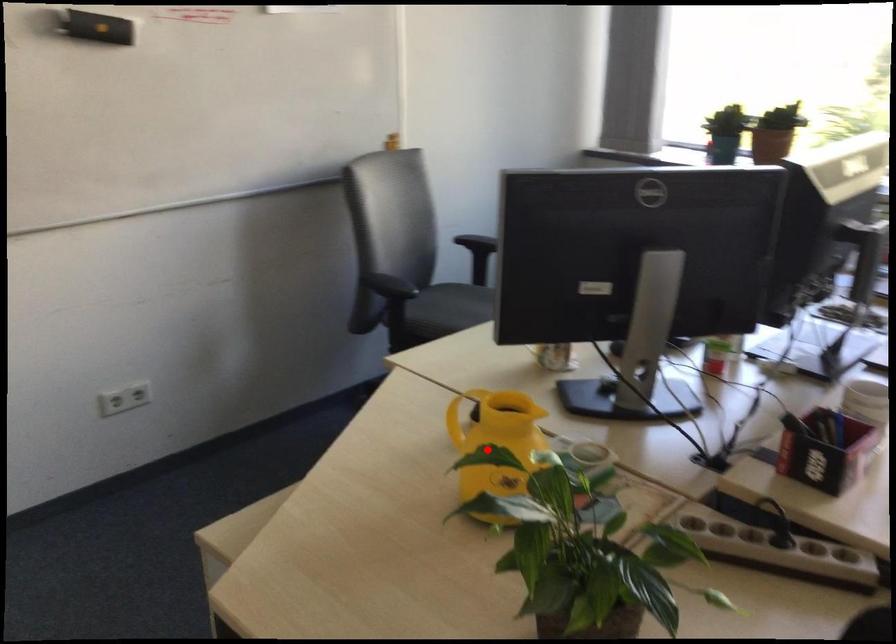
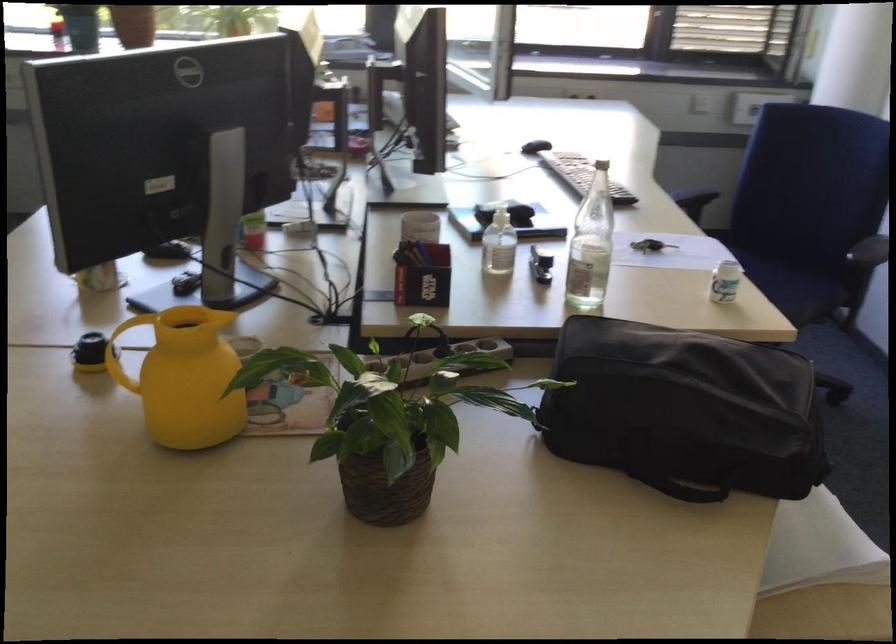
Find the pixel in the second image that matches the highlighted location in the first image.

(185, 377)